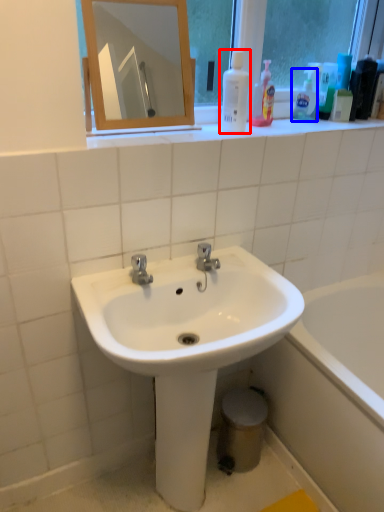
Question: Among these objects, which one is nearest to the camera, cleaning product (highlighted by a red box) or cleaning product (highlighted by a blue box)?

Choices:
 (A) cleaning product
 (B) cleaning product

Answer: (A)